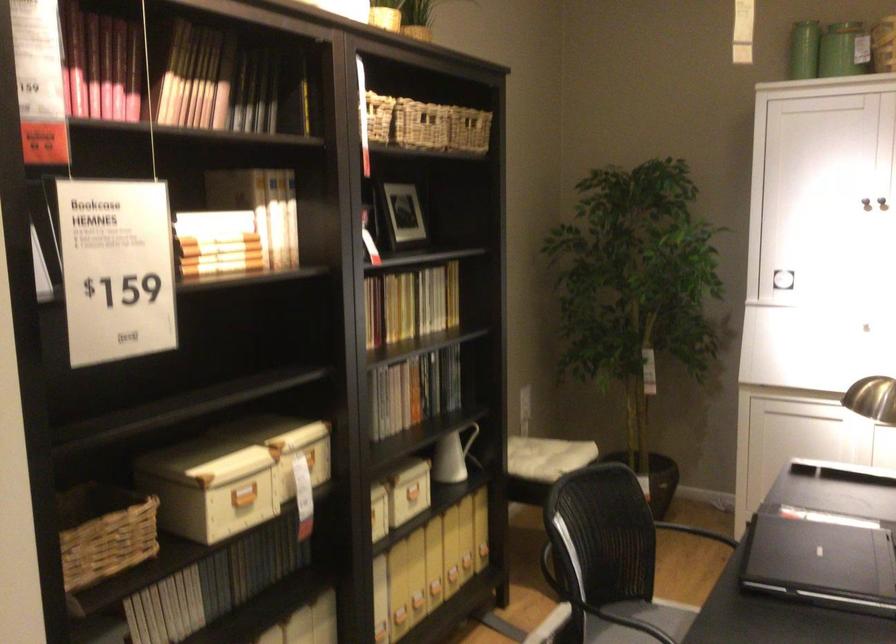
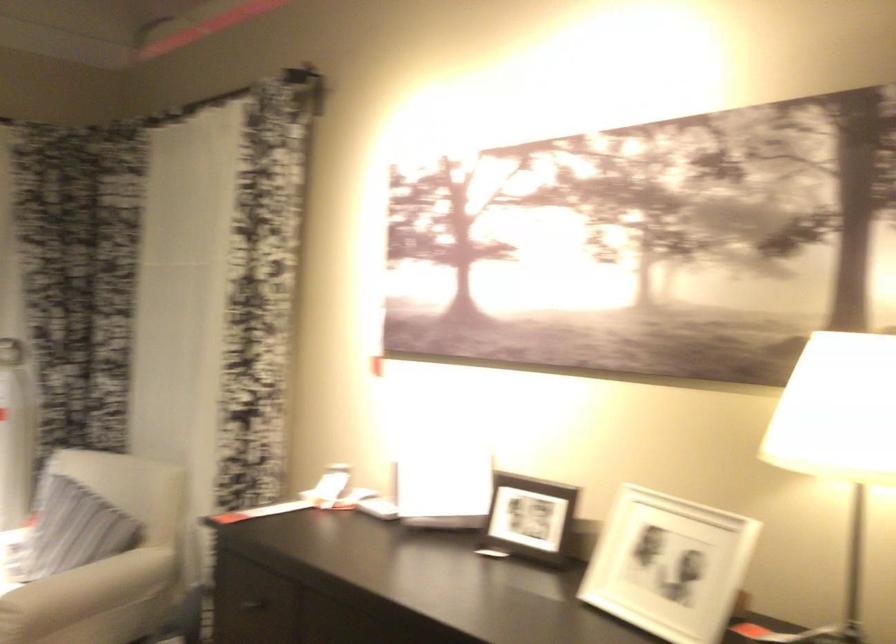
Question: The first image is from the beginning of the video and the second image is from the end. How did the camera likely rotate when shooting the video?

Choices:
 (A) Left
 (B) Right
 (C) Up
 (D) Down

Answer: (B)